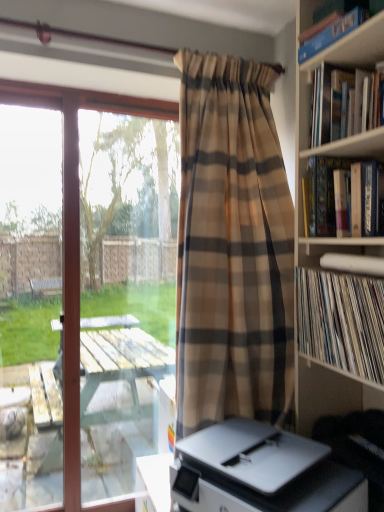
Describe the element at coordinates (245, 489) in the screenshot. I see `white plastic printer at lower center` at that location.

You are a GUI agent. You are given a task and a screenshot of the screen. Output one action in this format:
    pyautogui.click(x=<x>, y=<y>)
    Task: Click on the white vinyl records at right, which is the first book in bottom-to-top order
    The image size is (384, 512).
    Given the screenshot: What is the action you would take?
    pyautogui.click(x=342, y=321)

In order to click on plaid fabric curtain at center in this screenshot , I will do `click(232, 248)`.

What do you see at coordinates (332, 33) in the screenshot? The width and height of the screenshot is (384, 512). I see `blue hardcover book at upper right, which is counted as the fourth book, starting from the bottom` at bounding box center [332, 33].

This screenshot has height=512, width=384. Identify the location of hardcover book at upper right, marked as the second book in a bottom-to-top arrangement. 341,197.

You are a GUI agent. You are given a task and a screenshot of the screen. Output one action in this format:
    pyautogui.click(x=<x>, y=<y>)
    Task: Click on the white plastic printer at lower center
    The image size is (384, 512).
    Given the screenshot: What is the action you would take?
    pyautogui.click(x=245, y=489)

How different are the orientations of plaid fabric curtain at center and white plastic printer at lower center in degrees?

The facing directions of plaid fabric curtain at center and white plastic printer at lower center are 71.9 degrees apart.

Is plaid fabric curtain at center smaller than white plastic printer at lower center?

No, plaid fabric curtain at center is not smaller than white plastic printer at lower center.

Is the surface of plaid fabric curtain at center in direct contact with white plastic printer at lower center?

plaid fabric curtain at center is not next to white plastic printer at lower center, and they're not touching.

Is white plastic printer at lower center inside plaid fabric curtain at center?

That's incorrect, white plastic printer at lower center is not inside plaid fabric curtain at center.

Is plaid fabric curtain at center turned away from hardcover book at upper right, marked as the second book in a bottom-to-top arrangement?

No, plaid fabric curtain at center is not facing the opposite direction of hardcover book at upper right, marked as the second book in a bottom-to-top arrangement.

Between plaid fabric curtain at center and hardcover book at upper right, which ranks as the third book in top-to-bottom order, which one is positioned behind?

Positioned behind is plaid fabric curtain at center.

Is plaid fabric curtain at center taller or shorter than hardcover book at upper right, which ranks as the third book in top-to-bottom order?

Clearly, plaid fabric curtain at center is taller compared to hardcover book at upper right, which ranks as the third book in top-to-bottom order.

From the image's perspective, which object appears higher, plaid fabric curtain at center or hardcover book at upper right, marked as the second book in a bottom-to-top arrangement?

From the image's view, hardcover book at upper right, marked as the second book in a bottom-to-top arrangement, is above.

Is white vinyl records at right, which is the first book in bottom-to-top order, facing towards blue hardcover book at upper right, the 1th book positioned from the top?

No, white vinyl records at right, which is the first book in bottom-to-top order, is not aimed at blue hardcover book at upper right, the 1th book positioned from the top.

Considering the positions of objects white vinyl records at right, which is the first book in bottom-to-top order, and blue hardcover book at upper right, the 1th book positioned from the top, in the image provided, who is in front, white vinyl records at right, which is the first book in bottom-to-top order, or blue hardcover book at upper right, the 1th book positioned from the top,?

white vinyl records at right, which is the first book in bottom-to-top order, is in front.

Is white vinyl records at right, which is the first book in bottom-to-top order, bigger or smaller than blue hardcover book at upper right, the 1th book positioned from the top?

Considering their sizes, white vinyl records at right, which is the first book in bottom-to-top order, takes up more space than blue hardcover book at upper right, the 1th book positioned from the top.

Is white vinyl records at right, which is the first book in bottom-to-top order, far away from blue hardcover book at upper right, the 1th book positioned from the top?

Result: No, white vinyl records at right, which is the first book in bottom-to-top order, is not far away from blue hardcover book at upper right, the 1th book positioned from the top.

Is hardcover book at upper right, marked as the second book in a bottom-to-top arrangement, outside of blue hardcover book at upper right, the 1th book positioned from the top?

hardcover book at upper right, marked as the second book in a bottom-to-top arrangement, is positioned outside blue hardcover book at upper right, the 1th book positioned from the top.

From the image's perspective, which object appears higher, hardcover book at upper right, marked as the second book in a bottom-to-top arrangement, or blue hardcover book at upper right, the 1th book positioned from the top?

blue hardcover book at upper right, the 1th book positioned from the top, from the image's perspective.

Is hardcover book at upper right, marked as the second book in a bottom-to-top arrangement, smaller than blue hardcover book at upper right, the 1th book positioned from the top?

Incorrect, hardcover book at upper right, marked as the second book in a bottom-to-top arrangement, is not smaller in size than blue hardcover book at upper right, the 1th book positioned from the top.

Does hardcover book at upper right, which ranks as the third book in top-to-bottom order, appear on the right side of blue hardcover book at upper right, the 1th book positioned from the top?

Yes.

Can you confirm if blue hardcover book at upper right, the 1th book positioned from the top, is shorter than plaid fabric curtain at center?

Yes.

From the image's perspective, which is above, blue hardcover book at upper right, which is counted as the fourth book, starting from the bottom, or plaid fabric curtain at center?

blue hardcover book at upper right, which is counted as the fourth book, starting from the bottom.

From the picture: Which of these two, blue hardcover book at upper right, the 1th book positioned from the top, or plaid fabric curtain at center, is smaller?

blue hardcover book at upper right, the 1th book positioned from the top, is smaller.

Would you say blue hardcover book at upper right, the 1th book positioned from the top, is to the left or to the right of plaid fabric curtain at center in the picture?

Clearly, blue hardcover book at upper right, the 1th book positioned from the top, is on the right of plaid fabric curtain at center in the image.

From the image's perspective, which one is positioned higher, hardcover book at upper right, the second book positioned from the top, or white plastic printer at lower center?

hardcover book at upper right, the second book positioned from the top, from the image's perspective.

Is hardcover book at upper right, the second book positioned from the top, further to camera compared to white plastic printer at lower center?

Yes, it is.

Is hardcover book at upper right, acting as the 3th book starting from the bottom, surrounding white plastic printer at lower center?

Definitely not — white plastic printer at lower center is not inside hardcover book at upper right, acting as the 3th book starting from the bottom.

From the picture: Is plaid fabric curtain at center closer to the viewer compared to hardcover book at upper right, acting as the 3th book starting from the bottom?

That is False.

How different are the orientations of plaid fabric curtain at center and hardcover book at upper right, the second book positioned from the top, in degrees?

→ The angular difference between plaid fabric curtain at center and hardcover book at upper right, the second book positioned from the top, is 94.8 degrees.

Is plaid fabric curtain at center located outside hardcover book at upper right, acting as the 3th book starting from the bottom?

plaid fabric curtain at center lies outside hardcover book at upper right, acting as the 3th book starting from the bottom,'s area.

Are plaid fabric curtain at center and hardcover book at upper right, acting as the 3th book starting from the bottom, located far from each other?

No, there isn't a large distance between plaid fabric curtain at center and hardcover book at upper right, acting as the 3th book starting from the bottom.

You are a GUI agent. You are given a task and a screenshot of the screen. Output one action in this format:
    pyautogui.click(x=<x>, y=<y>)
    Task: Click on the table below the plaid fabric curtain at center (from a real-world perspective)
    This screenshot has width=384, height=512.
    Given the screenshot: What is the action you would take?
    pyautogui.click(x=245, y=489)

The width and height of the screenshot is (384, 512). In order to click on curtain on the left of hardcover book at upper right, marked as the second book in a bottom-to-top arrangement in this screenshot , I will do `click(232, 248)`.

Looking at the image, which one is located closer to white vinyl records at right, which is the first book in bottom-to-top order, plaid fabric curtain at center or white plastic printer at lower center?

plaid fabric curtain at center is positioned closer to the anchor white vinyl records at right, which is the first book in bottom-to-top order.

Which object lies nearer to the anchor point plaid fabric curtain at center, hardcover book at upper right, the second book positioned from the top, or blue hardcover book at upper right, which is counted as the fourth book, starting from the bottom?

hardcover book at upper right, the second book positioned from the top, is closer to plaid fabric curtain at center.

Considering their positions, is plaid fabric curtain at center positioned further to white vinyl records at right, marked as the 4th book in a top-to-bottom arrangement, than hardcover book at upper right, which ranks as the third book in top-to-bottom order?

The object further to white vinyl records at right, marked as the 4th book in a top-to-bottom arrangement, is plaid fabric curtain at center.

From the image, which object appears to be farther from transparent glass window at left, hardcover book at upper right, acting as the 3th book starting from the bottom, or plaid fabric curtain at center?

hardcover book at upper right, acting as the 3th book starting from the bottom, lies further to transparent glass window at left than the other object.

Estimate the real-world distances between objects in this image. Which object is further from hardcover book at upper right, marked as the second book in a bottom-to-top arrangement, blue hardcover book at upper right, the 1th book positioned from the top, or plaid fabric curtain at center?

The object further to hardcover book at upper right, marked as the second book in a bottom-to-top arrangement, is blue hardcover book at upper right, the 1th book positioned from the top.

From the image, which object appears to be nearer to blue hardcover book at upper right, which is counted as the fourth book, starting from the bottom, white plastic printer at lower center or white vinyl records at right, which is the first book in bottom-to-top order?

Among the two, white vinyl records at right, which is the first book in bottom-to-top order, is located nearer to blue hardcover book at upper right, which is counted as the fourth book, starting from the bottom.

When comparing their distances from plaid fabric curtain at center, does transparent glass window at left or hardcover book at upper right, marked as the second book in a bottom-to-top arrangement, seem further?

Among the two, transparent glass window at left is located further to plaid fabric curtain at center.

When comparing their distances from hardcover book at upper right, marked as the second book in a bottom-to-top arrangement, does white vinyl records at right, which is the first book in bottom-to-top order, or transparent glass window at left seem closer?

The object closer to hardcover book at upper right, marked as the second book in a bottom-to-top arrangement, is white vinyl records at right, which is the first book in bottom-to-top order.

Where is `curtain between hardcover book at upper right, the second book positioned from the top, and white plastic printer at lower center, in the vertical direction`? curtain between hardcover book at upper right, the second book positioned from the top, and white plastic printer at lower center, in the vertical direction is located at coordinates (232, 248).

Where is `book between hardcover book at upper right, the second book positioned from the top, and white vinyl records at right, which is the first book in bottom-to-top order, in the up-down direction`? book between hardcover book at upper right, the second book positioned from the top, and white vinyl records at right, which is the first book in bottom-to-top order, in the up-down direction is located at coordinates (341, 197).

At what (x,y) coordinates should I click in order to perform the action: click on curtain between hardcover book at upper right, acting as the 3th book starting from the bottom, and white vinyl records at right, which is the first book in bottom-to-top order, in the up-down direction. Please return your answer as a coordinate pair (x, y). Looking at the image, I should click on (232, 248).

Where is `book between hardcover book at upper right, acting as the 3th book starting from the bottom, and plaid fabric curtain at center from top to bottom`? book between hardcover book at upper right, acting as the 3th book starting from the bottom, and plaid fabric curtain at center from top to bottom is located at coordinates (341, 197).